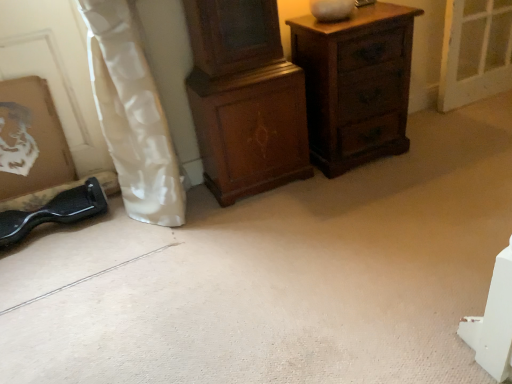
Measure the distance between wooden chest of drawers at upper right, which appears as the 2th chest of drawers when viewed from the left, and camera.

The depth of wooden chest of drawers at upper right, which appears as the 2th chest of drawers when viewed from the left, is 5.64 feet.

Identify the location of wooden cabinet at center, positioned as the first chest of drawers in left-to-right order. (245, 99).

Measure the distance between point (68,150) and camera.

Point (68,150) and camera are 6.96 feet apart.

Where is `white glossy curtain at left`? This screenshot has width=512, height=384. white glossy curtain at left is located at coordinates (132, 115).

Identify the location of wooden chest of drawers at upper right, the first chest of drawers in the right-to-left sequence. This screenshot has height=384, width=512. (356, 84).

From a real-world perspective, is wooden picture frame at lower left under white glossy curtain at left?

Yes, from a real-world perspective, wooden picture frame at lower left is under white glossy curtain at left.

Is point (28, 157) in front of point (180, 217)?

No.

Choose the correct answer: Is wooden picture frame at lower left inside white glossy curtain at left or outside it?

wooden picture frame at lower left lies outside white glossy curtain at left.

Does wooden picture frame at lower left appear on the left side of white glossy curtain at left?

Yes.

Does white glossy curtain at left come behind wooden picture frame at lower left?

No, it is in front of wooden picture frame at lower left.

Considering the relative sizes of white glossy curtain at left and wooden picture frame at lower left in the image provided, is white glossy curtain at left taller than wooden picture frame at lower left?

Yes.

Is white glossy curtain at left wider than wooden picture frame at lower left?

Correct, the width of white glossy curtain at left exceeds that of wooden picture frame at lower left.

Can you confirm if white glossy curtain at left is bigger than wooden picture frame at lower left?

Correct, white glossy curtain at left is larger in size than wooden picture frame at lower left.

Can you confirm if wooden chest of drawers at upper right, the first chest of drawers in the right-to-left sequence, is smaller than wooden cabinet at center, positioned as the first chest of drawers in left-to-right order?

Correct, wooden chest of drawers at upper right, the first chest of drawers in the right-to-left sequence, occupies less space than wooden cabinet at center, positioned as the first chest of drawers in left-to-right order.

Can you tell me how much wooden chest of drawers at upper right, which appears as the 2th chest of drawers when viewed from the left, and wooden cabinet at center, positioned as the first chest of drawers in left-to-right order, differ in facing direction?

1.99 degrees separate the facing orientations of wooden chest of drawers at upper right, which appears as the 2th chest of drawers when viewed from the left, and wooden cabinet at center, positioned as the first chest of drawers in left-to-right order.

From the image's perspective, is wooden chest of drawers at upper right, the first chest of drawers in the right-to-left sequence, on top of wooden cabinet at center, positioned as the first chest of drawers in left-to-right order?

Yes.

Is white glossy curtain at left touching wooden cabinet at center, positioned as the first chest of drawers in left-to-right order?

white glossy curtain at left is not next to wooden cabinet at center, positioned as the first chest of drawers in left-to-right order, and they're not touching.

From a real-world perspective, count 1st chest of drawerss downward from the white glossy curtain at left and point to it. Please provide its 2D coordinates.

[(245, 99)]

Visually, is white glossy curtain at left positioned to the left or to the right of wooden cabinet at center, positioned as the first chest of drawers in left-to-right order?

white glossy curtain at left is to the left of wooden cabinet at center, positioned as the first chest of drawers in left-to-right order.

Who is taller, wooden cabinet at center, which ranks as the 2th chest of drawers in right-to-left order, or white glossy curtain at left?

white glossy curtain at left is taller.

Looking at this image, from the image's perspective, would you say wooden cabinet at center, positioned as the first chest of drawers in left-to-right order, is shown under white glossy curtain at left?

No, from the image's perspective, wooden cabinet at center, positioned as the first chest of drawers in left-to-right order, is not beneath white glossy curtain at left.

Is point (305, 131) positioned after point (146, 109)?

Yes, point (305, 131) is behind point (146, 109).

Looking at this image, what's the angular difference between wooden cabinet at center, positioned as the first chest of drawers in left-to-right order, and white glossy curtain at left's facing directions?

The angle between the facing direction of wooden cabinet at center, positioned as the first chest of drawers in left-to-right order, and the facing direction of white glossy curtain at left is 0.356 degrees.

Which point is more distant from viewer, (279,125) or (41,140)?

The point (41,140) is more distant.

In the image, is wooden cabinet at center, positioned as the first chest of drawers in left-to-right order, positioned in front of or behind wooden picture frame at lower left?

wooden cabinet at center, positioned as the first chest of drawers in left-to-right order, is positioned closer to the viewer than wooden picture frame at lower left.

From the image's perspective, who appears lower, wooden cabinet at center, which ranks as the 2th chest of drawers in right-to-left order, or wooden picture frame at lower left?

wooden picture frame at lower left.

Can you confirm if wooden cabinet at center, which ranks as the 2th chest of drawers in right-to-left order, is shorter than wooden picture frame at lower left?

In fact, wooden cabinet at center, which ranks as the 2th chest of drawers in right-to-left order, may be taller than wooden picture frame at lower left.

In the scene shown: Can you tell me how much white glossy curtain at left and wooden chest of drawers at upper right, which appears as the 2th chest of drawers when viewed from the left, differ in facing direction?

They differ by 1.63 degrees in their facing directions.

Is white glossy curtain at left directly adjacent to wooden chest of drawers at upper right, which appears as the 2th chest of drawers when viewed from the left?

No, white glossy curtain at left is not in contact with wooden chest of drawers at upper right, which appears as the 2th chest of drawers when viewed from the left.

Is white glossy curtain at left positioned with its back to wooden chest of drawers at upper right, the first chest of drawers in the right-to-left sequence?

No, white glossy curtain at left is not facing away from wooden chest of drawers at upper right, the first chest of drawers in the right-to-left sequence.

In the image, there is a wooden picture frame at lower left. Identify the location of curtain above it (from the image's perspective). The height and width of the screenshot is (384, 512). (132, 115).

The width and height of the screenshot is (512, 384). I want to click on picture frame lying below the white glossy curtain at left (from the image's perspective), so click(31, 139).

From the image, which object appears to be nearer to wooden picture frame at lower left, wooden cabinet at center, positioned as the first chest of drawers in left-to-right order, or white glossy curtain at left?

white glossy curtain at left is closer to wooden picture frame at lower left.

Looking at this image, from the image, which object appears to be farther from wooden chest of drawers at upper right, which appears as the 2th chest of drawers when viewed from the left, white glossy curtain at left or wooden picture frame at lower left?

Among the two, wooden picture frame at lower left is located further to wooden chest of drawers at upper right, which appears as the 2th chest of drawers when viewed from the left.

When comparing their distances from wooden cabinet at center, which ranks as the 2th chest of drawers in right-to-left order, does wooden picture frame at lower left or white glossy curtain at left seem further?

wooden picture frame at lower left.

Estimate the real-world distances between objects in this image. Which object is closer to wooden cabinet at center, which ranks as the 2th chest of drawers in right-to-left order, white glossy curtain at left or wooden picture frame at lower left?

white glossy curtain at left.

When comparing their distances from wooden chest of drawers at upper right, which appears as the 2th chest of drawers when viewed from the left, does wooden picture frame at lower left or wooden cabinet at center, positioned as the first chest of drawers in left-to-right order, seem further?

wooden picture frame at lower left lies further to wooden chest of drawers at upper right, which appears as the 2th chest of drawers when viewed from the left, than the other object.

Which object lies nearer to the anchor point wooden chest of drawers at upper right, which appears as the 2th chest of drawers when viewed from the left, wooden cabinet at center, which ranks as the 2th chest of drawers in right-to-left order, or white glossy curtain at left?

wooden cabinet at center, which ranks as the 2th chest of drawers in right-to-left order, is closer to wooden chest of drawers at upper right, which appears as the 2th chest of drawers when viewed from the left.

Which object lies nearer to the anchor point white glossy curtain at left, wooden cabinet at center, positioned as the first chest of drawers in left-to-right order, or wooden chest of drawers at upper right, the first chest of drawers in the right-to-left sequence?

wooden cabinet at center, positioned as the first chest of drawers in left-to-right order, is positioned closer to the anchor white glossy curtain at left.

From the image, which object appears to be farther from white glossy curtain at left, wooden picture frame at lower left or wooden cabinet at center, positioned as the first chest of drawers in left-to-right order?

Based on the image, wooden picture frame at lower left appears to be further to white glossy curtain at left.

Locate an element on the screen. curtain located between wooden picture frame at lower left and wooden cabinet at center, which ranks as the 2th chest of drawers in right-to-left order, in the left-right direction is located at coordinates (132, 115).

This screenshot has height=384, width=512. What are the coordinates of `the chest of drawers located between wooden picture frame at lower left and wooden chest of drawers at upper right, the first chest of drawers in the right-to-left sequence, in the left-right direction` in the screenshot? It's located at (245, 99).

At what (x,y) coordinates should I click in order to perform the action: click on the chest of drawers situated between white glossy curtain at left and wooden chest of drawers at upper right, the first chest of drawers in the right-to-left sequence, from left to right. Please return your answer as a coordinate pair (x, y). This screenshot has width=512, height=384. Looking at the image, I should click on (245, 99).

The height and width of the screenshot is (384, 512). In order to click on curtain between wooden picture frame at lower left and wooden chest of drawers at upper right, which appears as the 2th chest of drawers when viewed from the left, in the horizontal direction in this screenshot , I will do `click(132, 115)`.